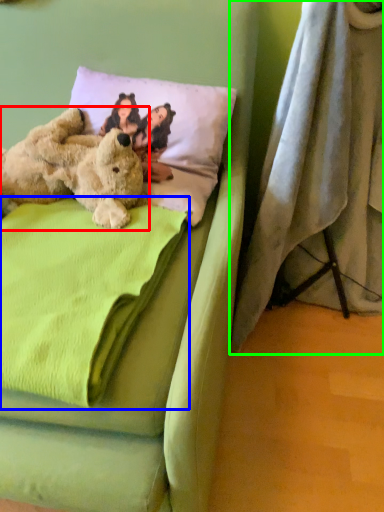
Question: Considering the real-world distances, which object is farthest from teddy bear (highlighted by a red box)? blanket (highlighted by a blue box) or curtain (highlighted by a green box)?

Choices:
 (A) blanket
 (B) curtain

Answer: (B)